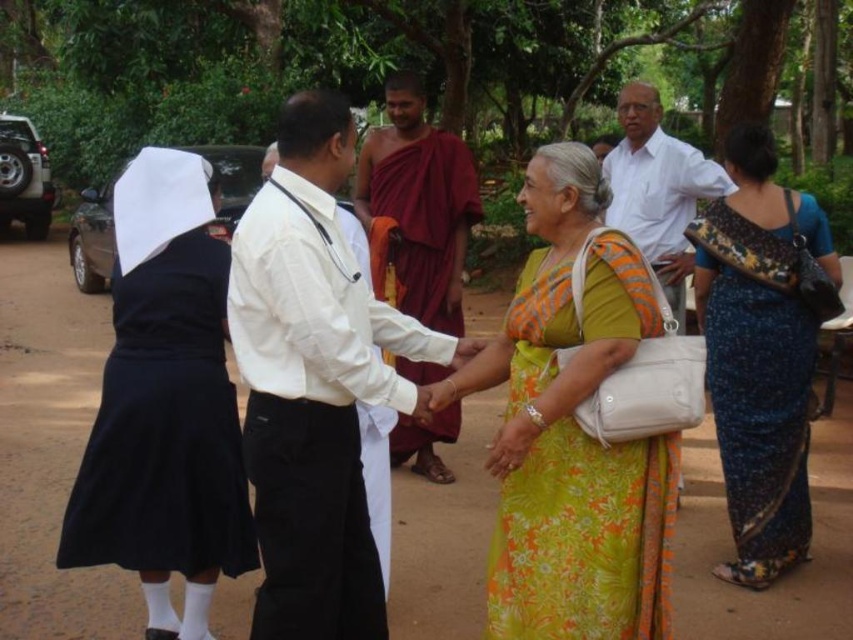
Question: Does maroon clothed monk at center lie behind white cotton shirt at upper right?

Choices:
 (A) yes
 (B) no

Answer: (B)

Question: Which of the following is the closest to the observer?

Choices:
 (A) white cotton shirt at upper right
 (B) maroon clothed monk at center
 (C) white smooth shirt at center

Answer: (C)

Question: Is black fabric dress at left smaller than white cotton shirt at upper right?

Choices:
 (A) no
 (B) yes

Answer: (B)

Question: Which point is closer to the camera?

Choices:
 (A) white cotton shirt at upper right
 (B) black fabric dress at left
 (C) white smooth shirt at center
 (D) maroon clothed monk at center

Answer: (C)

Question: Among these objects, which one is nearest to the camera?

Choices:
 (A) green floral fabric dress at center
 (B) blue floral saree at lower right

Answer: (A)

Question: Does black fabric dress at left lie in front of white cotton shirt at upper right?

Choices:
 (A) yes
 (B) no

Answer: (A)